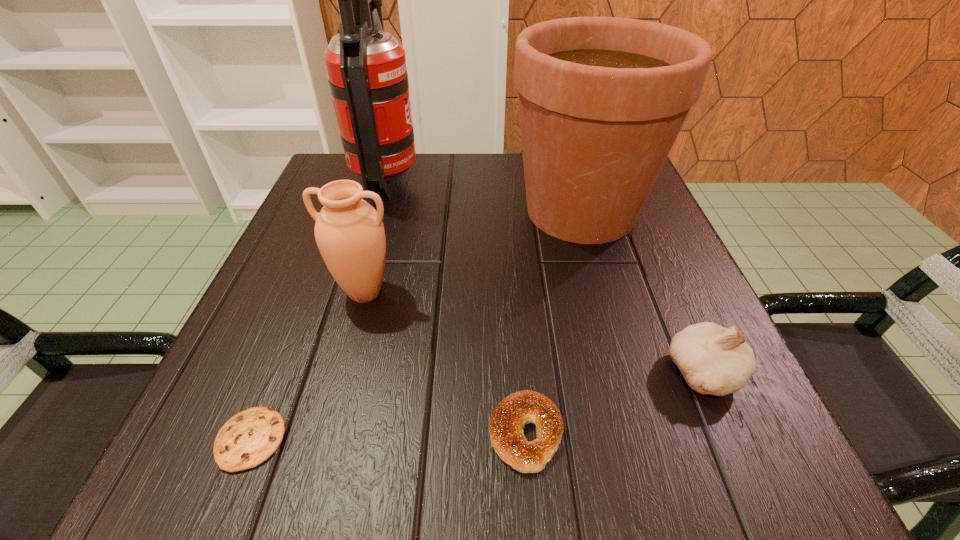
The height and width of the screenshot is (540, 960). I want to click on free space located on the left of the third shortest object, so click(x=540, y=372).

The width and height of the screenshot is (960, 540). In order to click on vacant region located 0.150m on the right of the bagel in this screenshot , I will do `click(680, 434)`.

I want to click on vacant point located 0.330m on the right of the cookie, so click(x=543, y=440).

Locate an element on the screen. Image resolution: width=960 pixels, height=540 pixels. fire extinguisher present at the far edge is located at coordinates (366, 67).

Image resolution: width=960 pixels, height=540 pixels. In order to click on flowerpot present at the far edge in this screenshot , I will do `click(602, 100)`.

I want to click on bagel that is at the near edge, so click(506, 425).

Identify the location of cookie at the near edge. This screenshot has height=540, width=960. click(250, 437).

This screenshot has height=540, width=960. I want to click on fire extinguisher that is at the left edge, so click(x=366, y=67).

The width and height of the screenshot is (960, 540). In order to click on urn that is at the left edge in this screenshot , I will do `click(349, 232)`.

This screenshot has height=540, width=960. I want to click on cookie that is at the left edge, so click(x=250, y=437).